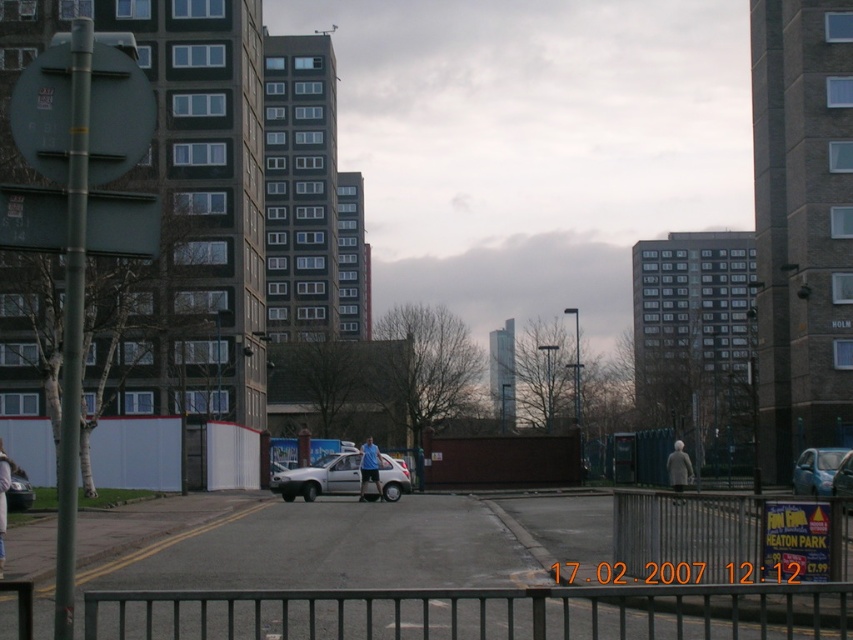
Question: Which of these objects is positioned closest to the black metal fence at lower center?

Choices:
 (A) metallic silver fence at lower center
 (B) blue metallic car at right
 (C) silver metallic car at lower left

Answer: (A)

Question: Does black metal fence at lower center come in front of metallic silver fence at lower center?

Choices:
 (A) yes
 (B) no

Answer: (A)

Question: Based on their relative distances, which object is farther from the silver metallic car at lower left?

Choices:
 (A) black metal fence at lower center
 (B) silver metallic hatchback at center
 (C) metallic silver fence at lower center

Answer: (A)

Question: Which object is farther from the camera taking this photo?

Choices:
 (A) blue metallic car at right
 (B) black metal fence at lower center

Answer: (A)

Question: Where is metallic silver fence at lower center located in relation to blue metallic car at right in the image?

Choices:
 (A) right
 (B) left

Answer: (B)

Question: Does metallic silver fence at lower center come in front of blue metallic car at right?

Choices:
 (A) yes
 (B) no

Answer: (A)